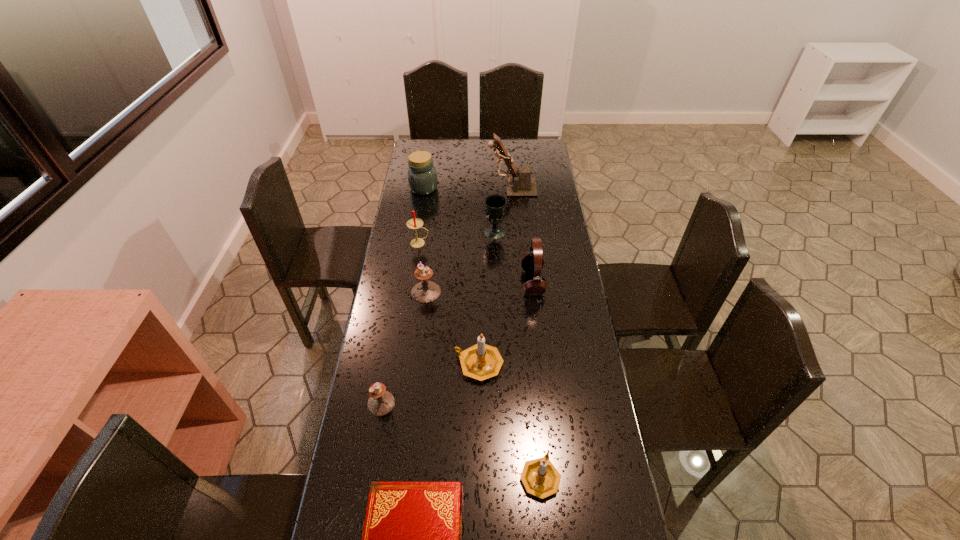
This screenshot has width=960, height=540. What are the coordinates of `the smaller purple candle holder` in the screenshot? It's located at (381, 402).

Image resolution: width=960 pixels, height=540 pixels. I want to click on the third farthest candle holder, so (381, 402).

At what (x,y) coordinates should I click in order to perform the action: click on the right gold candle holder. Please return your answer as a coordinate pair (x, y). This screenshot has height=540, width=960. Looking at the image, I should click on (540, 478).

At what (x,y) coordinates should I click in order to perform the action: click on the nearer gold candle holder. Please return your answer as a coordinate pair (x, y). The height and width of the screenshot is (540, 960). Looking at the image, I should click on (540, 478).

At what (x,y) coordinates should I click in order to perform the action: click on vacant area situated 0.240m on the front-facing side of the figurine. Please return your answer as a coordinate pair (x, y). This screenshot has height=540, width=960. Looking at the image, I should click on (438, 188).

This screenshot has width=960, height=540. What are the coordinates of `free space located on the front-facing side of the figurine` in the screenshot? It's located at (419, 188).

Identify the location of blank area located on the front-facing side of the figurine. The image size is (960, 540). (467, 188).

Find the location of a particular element. This screenshot has width=960, height=540. free space located 0.310m on the ear pads of the headset is located at coordinates (441, 282).

Identify the location of blank space located on the ear pads of the headset. This screenshot has width=960, height=540. (427, 282).

I want to click on free space located 0.380m on the ear pads of the headset, so click(422, 282).